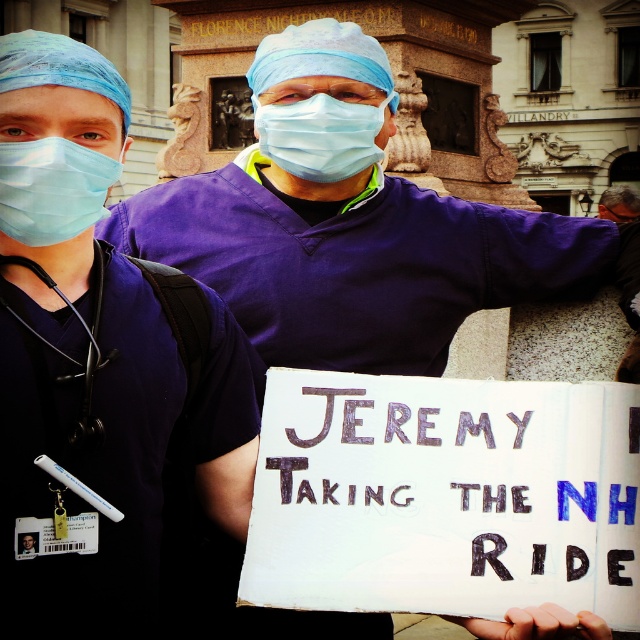
How distant is matte blue surgical mask at left from blue fabric mask at center?

The distance of matte blue surgical mask at left from blue fabric mask at center is 14.87 feet.

Is matte blue surgical mask at left positioned in front of blue fabric mask at center?

That is True.

Where is `matte blue surgical mask at left`? The image size is (640, 640). matte blue surgical mask at left is located at coordinates (51, 189).